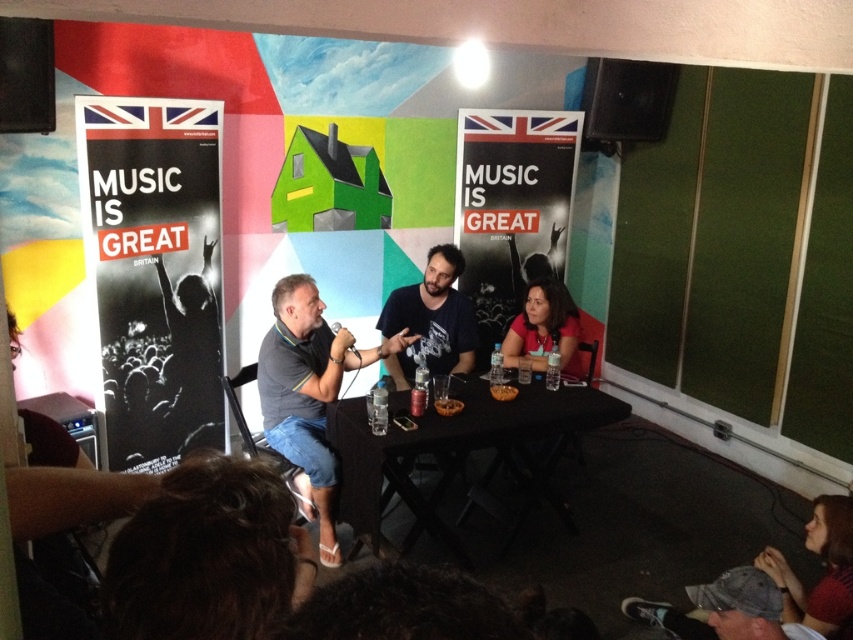
Question: Among these points, which one is farthest from the camera?

Choices:
 (A) (354, 360)
 (B) (447, 397)
 (C) (445, 252)
 (D) (460, 177)

Answer: (D)

Question: Among these objects, which one is nearest to the camera?

Choices:
 (A) dark blue t-shirt at center
 (B) matte red shirt at center
 (C) black paper poster at left

Answer: (C)

Question: Which object is closer to the camera taking this photo?

Choices:
 (A) black plastic table at center
 (B) dark blue t-shirt at center
 (C) black paper poster at center

Answer: (A)

Question: Can you confirm if black plastic table at center is smaller than matte red shirt at center?

Choices:
 (A) no
 (B) yes

Answer: (A)

Question: Considering the relative positions of black plastic table at center and translucent plastic cup at center in the image provided, where is black plastic table at center located with respect to translucent plastic cup at center?

Choices:
 (A) right
 (B) left

Answer: (A)

Question: Does black paper poster at left come in front of translucent plastic cup at center?

Choices:
 (A) yes
 (B) no

Answer: (B)